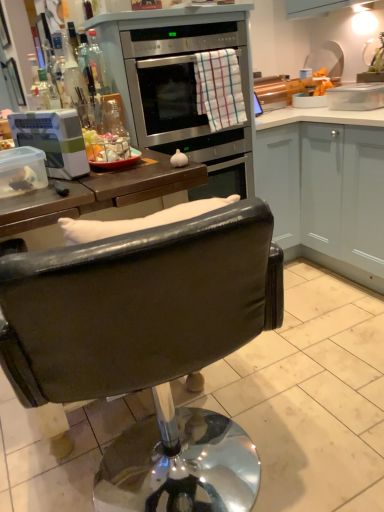
Question: Considering the relative sizes of stainless steel oven at upper center and checkered cotton towel at center in the image provided, is stainless steel oven at upper center wider than checkered cotton towel at center?

Choices:
 (A) yes
 (B) no

Answer: (A)

Question: From the image's perspective, does stainless steel oven at upper center appear higher than checkered cotton towel at center?

Choices:
 (A) no
 (B) yes

Answer: (B)

Question: Is stainless steel oven at upper center oriented away from checkered cotton towel at center?

Choices:
 (A) yes
 (B) no

Answer: (B)

Question: Could you tell me if stainless steel oven at upper center is turned towards checkered cotton towel at center?

Choices:
 (A) no
 (B) yes

Answer: (B)

Question: Are stainless steel oven at upper center and checkered cotton towel at center far apart?

Choices:
 (A) yes
 (B) no

Answer: (B)

Question: In terms of height, does white plastic container at left look taller or shorter compared to clear glass bottle at upper left?

Choices:
 (A) short
 (B) tall

Answer: (A)

Question: Choose the correct answer: Is white plastic container at left inside clear glass bottle at upper left or outside it?

Choices:
 (A) outside
 (B) inside

Answer: (A)

Question: Is point (16, 134) positioned closer to the camera than point (100, 53)?

Choices:
 (A) farther
 (B) closer

Answer: (B)

Question: Considering their positions, is white plastic container at left located in front of or behind clear glass bottle at upper left?

Choices:
 (A) behind
 (B) front

Answer: (B)

Question: Considering the positions of point (99, 86) and point (223, 101), is point (99, 86) closer or farther from the camera than point (223, 101)?

Choices:
 (A) closer
 (B) farther

Answer: (A)

Question: From a real-world perspective, is clear glass bottle at upper left positioned above or below checkered cotton towel at center?

Choices:
 (A) above
 (B) below

Answer: (A)

Question: From the image's perspective, is clear glass bottle at upper left above or below checkered cotton towel at center?

Choices:
 (A) below
 (B) above

Answer: (B)

Question: Based on their sizes in the image, would you say clear glass bottle at upper left is bigger or smaller than checkered cotton towel at center?

Choices:
 (A) small
 (B) big

Answer: (A)

Question: In terms of height, does clear glass bottle at upper left look taller or shorter compared to stainless steel oven at upper center?

Choices:
 (A) tall
 (B) short

Answer: (B)

Question: Is clear glass bottle at upper left situated inside stainless steel oven at upper center or outside?

Choices:
 (A) inside
 (B) outside

Answer: (B)